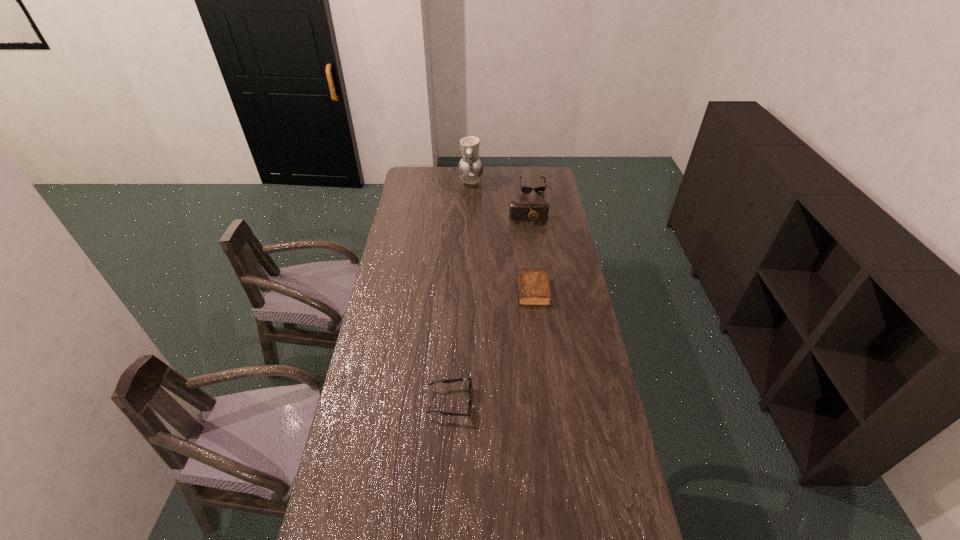
This screenshot has height=540, width=960. In order to click on vacant point located on the spine side of the fourth farthest object in this screenshot , I will do `click(488, 291)`.

I want to click on free spot located on the spine side of the fourth farthest object, so click(473, 291).

This screenshot has width=960, height=540. In order to click on blank space located on the spine side of the fourth farthest object in this screenshot , I will do [x=464, y=291].

You are a GUI agent. You are given a task and a screenshot of the screen. Output one action in this format:
    pyautogui.click(x=<x>, y=<y>)
    Task: Click on the free spot located 0.160m on the front-facing side of the nearer sunglasses
    The height and width of the screenshot is (540, 960).
    Given the screenshot: What is the action you would take?
    pos(522,402)

The height and width of the screenshot is (540, 960). Identify the location of pottery at the far edge. (470, 169).

Locate an element on the screen. sunglasses at the far edge is located at coordinates (524, 189).

The image size is (960, 540). I want to click on camera situated at the right edge, so click(531, 210).

Where is `sunglasses located in the right edge section of the desktop`? The image size is (960, 540). sunglasses located in the right edge section of the desktop is located at coordinates (524, 189).

At what (x,y) coordinates should I click in order to perform the action: click on diary that is at the right edge. Please return your answer as a coordinate pair (x, y). Image resolution: width=960 pixels, height=540 pixels. Looking at the image, I should click on [x=533, y=287].

The image size is (960, 540). In order to click on object present at the far right corner in this screenshot , I will do `click(524, 189)`.